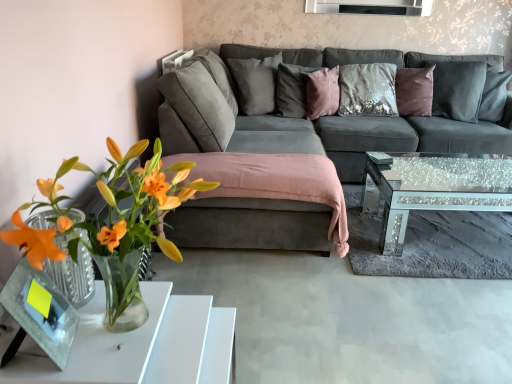
Question: In terms of width, does satin gray pillow at upper center, acting as the 4th pillow starting from the right, look wider or thinner when compared to pink velvet pillow at center, which is the third pillow in right-to-left order?

Choices:
 (A) thin
 (B) wide

Answer: (B)

Question: From the image's perspective, is satin gray pillow at upper center, which is the 1th pillow from left to right, above or below pink velvet pillow at center, which is the third pillow in right-to-left order?

Choices:
 (A) below
 (B) above

Answer: (B)

Question: Considering the real-world distances, which object is closest to the white glossy table at lower left?

Choices:
 (A) translucent glass vase at lower left
 (B) satin purple pillow at center, acting as the second pillow starting from the right
 (C) satin gray pillow at upper center, acting as the 4th pillow starting from the right
 (D) velvet purple pillow at upper right, acting as the 1th pillow starting from the right
 (E) pink velvet pillow at center, marked as the 2th pillow in a left-to-right arrangement

Answer: (A)

Question: Considering the real-world distances, which object is farthest from the translucent glass vase at lower left?

Choices:
 (A) satin purple pillow at center, arranged as the third pillow when viewed from the left
 (B) sparkly glass coffee table at center
 (C) pink velvet pillow at center, which is the third pillow in right-to-left order
 (D) suede gray couch at center
 (E) white glossy table at lower left

Answer: (A)